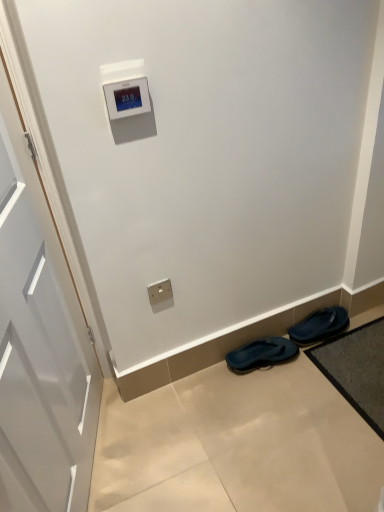
In order to click on empty space that is ontop of dark gray textured bath mat at lower right (from a real-world perspective) in this screenshot , I will do `click(362, 360)`.